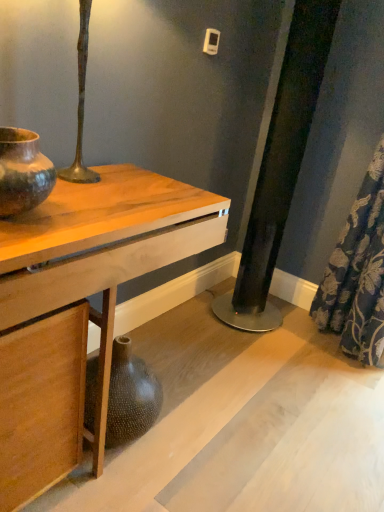
Locate an element on the screen. The image size is (384, 512). free location to the right of wooden table at center is located at coordinates (223, 431).